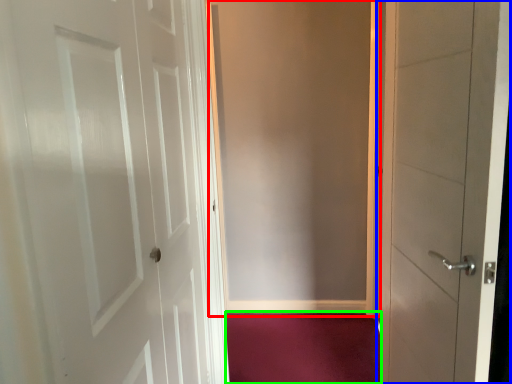
Question: Which object is the closest to the screen door (highlighted by a red box)? Choose among these: door (highlighted by a blue box) or plain (highlighted by a green box).

Choices:
 (A) door
 (B) plain

Answer: (B)